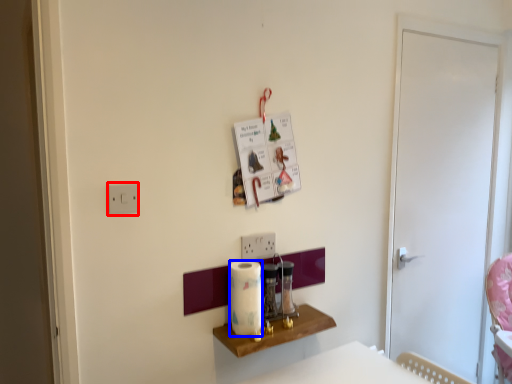
Question: Which object appears farthest to the camera in this image, light switch (highlighted by a red box) or paper towel (highlighted by a blue box)?

Choices:
 (A) light switch
 (B) paper towel

Answer: (B)